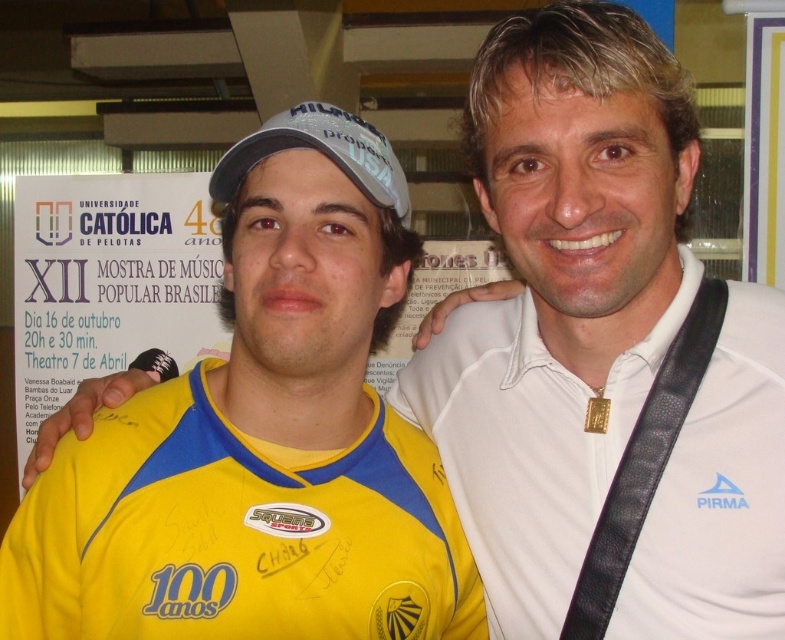
You are a photographer trying to focus on the white matte polo shirt at center. Where should you aim your camera lens to capture it accurately?

The white matte polo shirt at center is located at point 0.698 on the x axis and 0.671 on the y axis, so aim the camera lens at those coordinates to capture it accurately.

You are a photographer setting up for a group photo. You notice two white matte items at the center of the scene. Which one is taller between the white matte polo shirt at center and the white matte baseball cap at center?

The white matte polo shirt at center is taller than the white matte baseball cap at center according to the description.